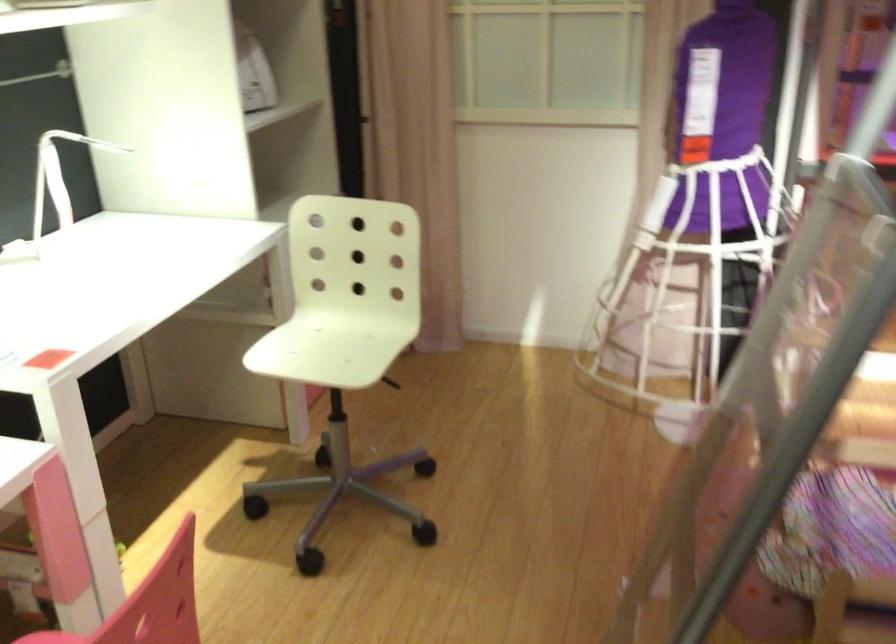
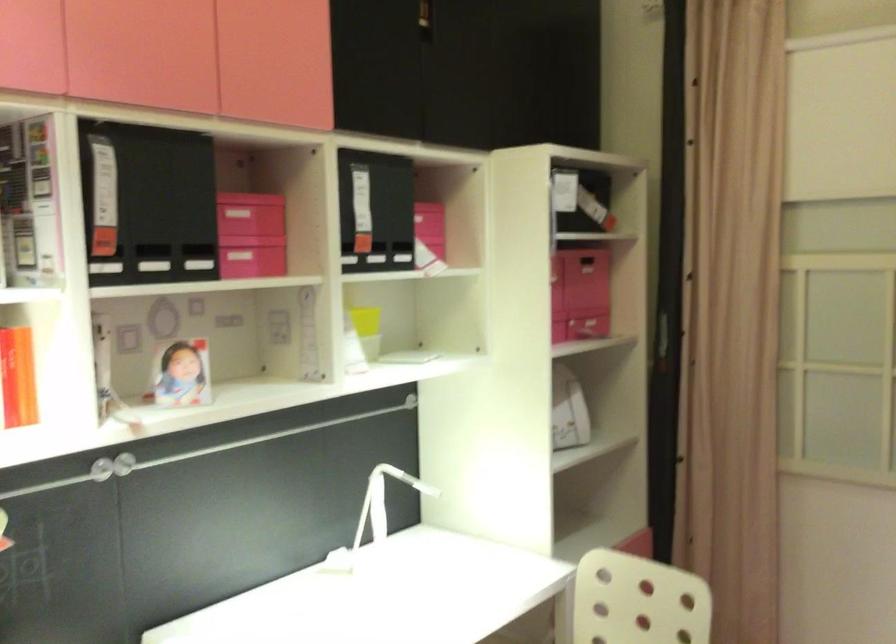
Based on the continuous images, in which direction is the camera rotating?

The rotation direction of the camera is left-up.